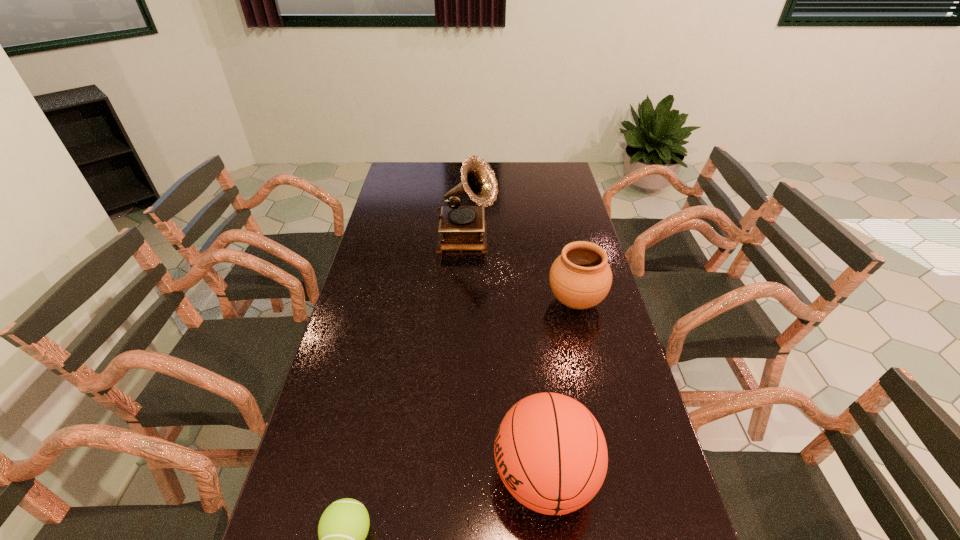
You are a GUI agent. You are given a task and a screenshot of the screen. Output one action in this format:
    pyautogui.click(x=<x>, y=<y>)
    Task: Click on the free space between the record player and the basketball
    Image resolution: width=960 pixels, height=540 pixels.
    Given the screenshot: What is the action you would take?
    pyautogui.click(x=506, y=359)

The width and height of the screenshot is (960, 540). In order to click on object that ranks as the second closest to the second shortest object in this screenshot , I will do `click(551, 454)`.

Locate an element on the screen. The height and width of the screenshot is (540, 960). object that stands as the third closest to the shortest object is located at coordinates (461, 228).

The width and height of the screenshot is (960, 540). Find the location of `blank area in the image that satisfies the following two spatial constraints: 1. on the back side of the third nearest object; 2. on the horn of the tallest object`. blank area in the image that satisfies the following two spatial constraints: 1. on the back side of the third nearest object; 2. on the horn of the tallest object is located at coordinates (562, 240).

Image resolution: width=960 pixels, height=540 pixels. Find the location of `vacant area that satisfies the following two spatial constraints: 1. on the horn of the pottery; 2. on the right side of the tallest object`. vacant area that satisfies the following two spatial constraints: 1. on the horn of the pottery; 2. on the right side of the tallest object is located at coordinates (465, 301).

Image resolution: width=960 pixels, height=540 pixels. I want to click on blank area in the image that satisfies the following two spatial constraints: 1. on the horn of the third nearest object; 2. on the left side of the farthest object, so click(465, 301).